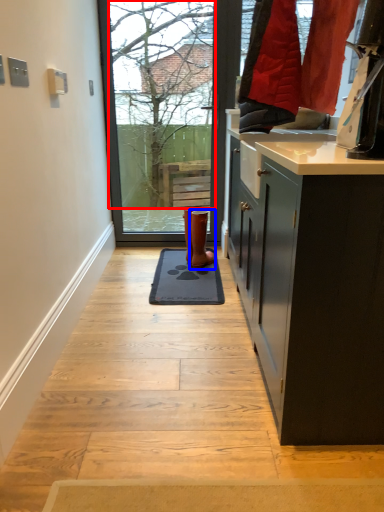
Question: Which object is further to the camera taking this photo, tree (highlighted by a red box) or footwear (highlighted by a blue box)?

Choices:
 (A) tree
 (B) footwear

Answer: (A)